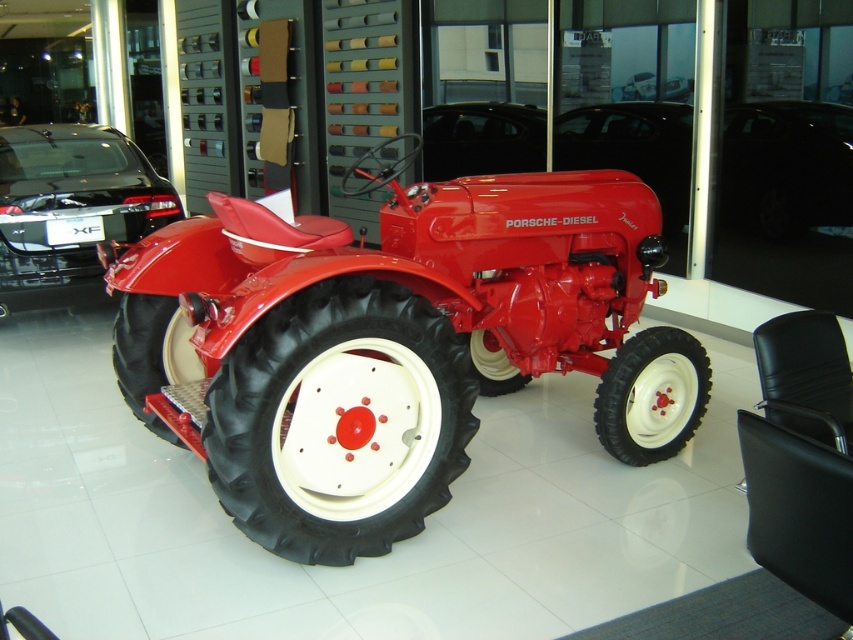
Question: Which is nearer to the shiny black car at center?

Choices:
 (A) black rubber tire at center
 (B) rubber/smooth tire at lower left

Answer: (A)

Question: Based on their relative distances, which object is farther from the rubber/soft tractor tire at center?

Choices:
 (A) matte red tractor at center
 (B) glossy black car at left

Answer: (B)

Question: Can you confirm if matte red tractor at center is thinner than rubber/soft tractor tire at center?

Choices:
 (A) no
 (B) yes

Answer: (A)

Question: Among these objects, which one is farthest from the camera?

Choices:
 (A) rubber/soft tractor tire at center
 (B) shiny black car at center

Answer: (B)

Question: Is the position of matte red tractor at center more distant than that of rubber/smooth tire at lower left?

Choices:
 (A) no
 (B) yes

Answer: (A)

Question: Considering the relative positions of shiny black car at center and white rubber tire at center in the image provided, where is shiny black car at center located with respect to white rubber tire at center?

Choices:
 (A) above
 (B) below

Answer: (A)